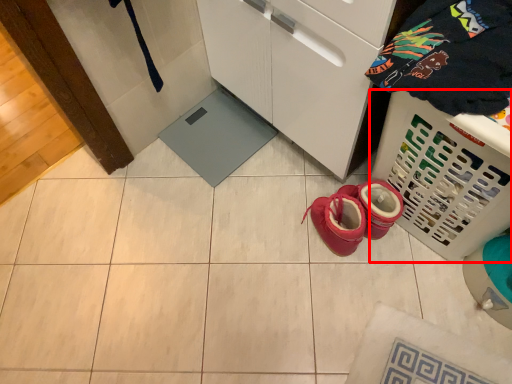
Question: Where is basket (annotated by the red box) located in relation to clothing in the image?

Choices:
 (A) left
 (B) right

Answer: (B)